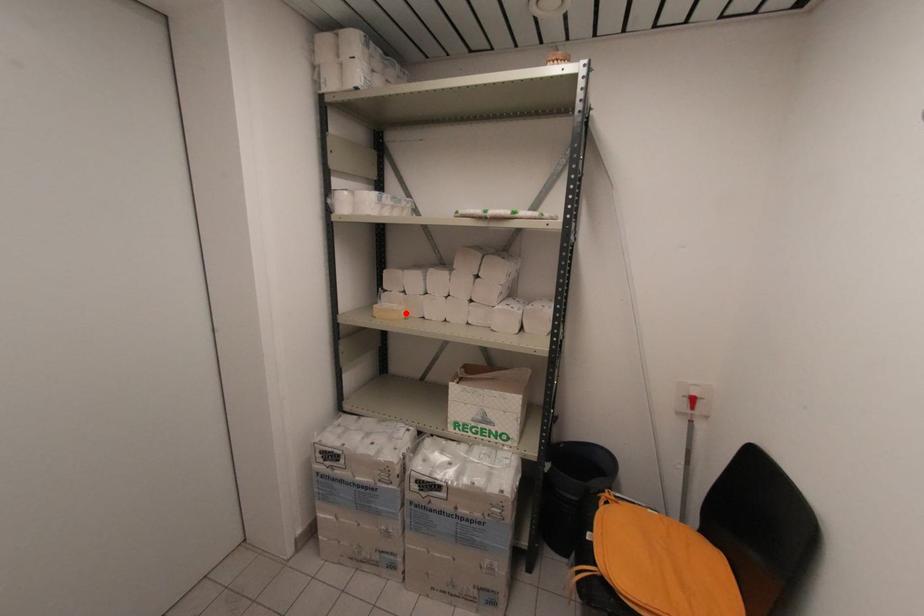
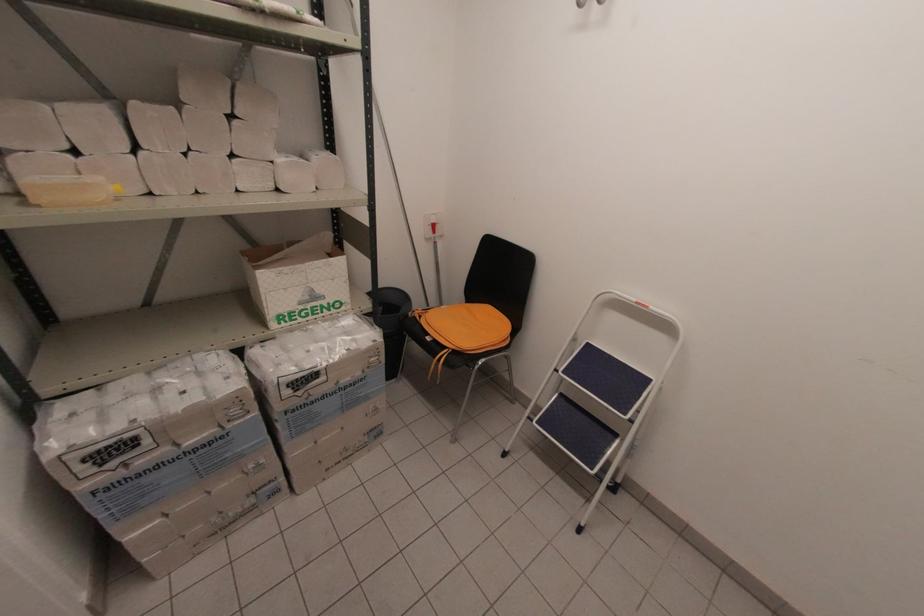
Locate, in the second image, the point that corresponds to the highlighted location in the first image.

(116, 188)